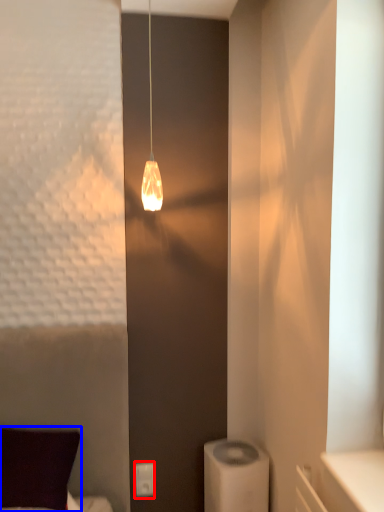
Question: Which object is further to the camera taking this photo, light switch (highlighted by a red box) or pillow (highlighted by a blue box)?

Choices:
 (A) light switch
 (B) pillow

Answer: (A)